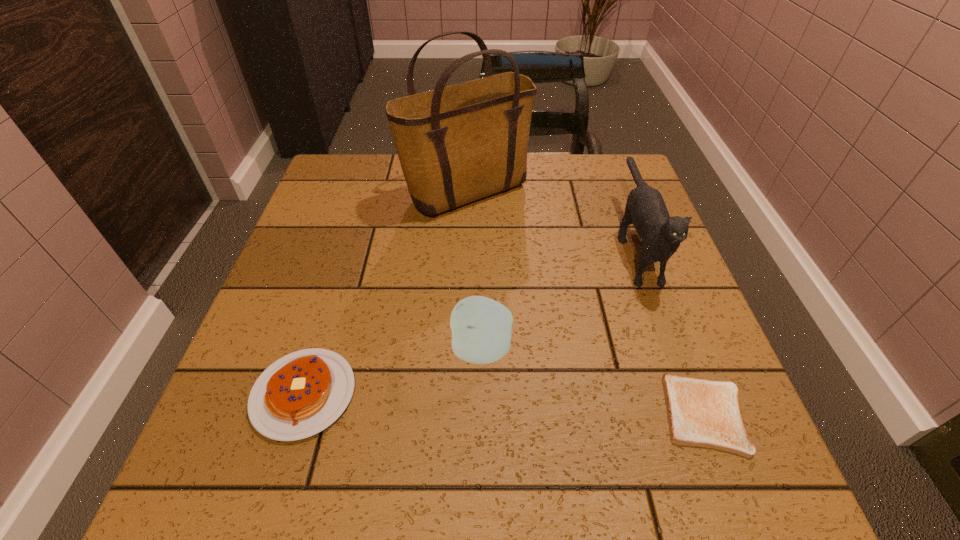
Where is `vacant region that satisfies the following two spatial constraints: 1. on the front-facing side of the cat; 2. on the right side of the shortest object`? vacant region that satisfies the following two spatial constraints: 1. on the front-facing side of the cat; 2. on the right side of the shortest object is located at coordinates (697, 414).